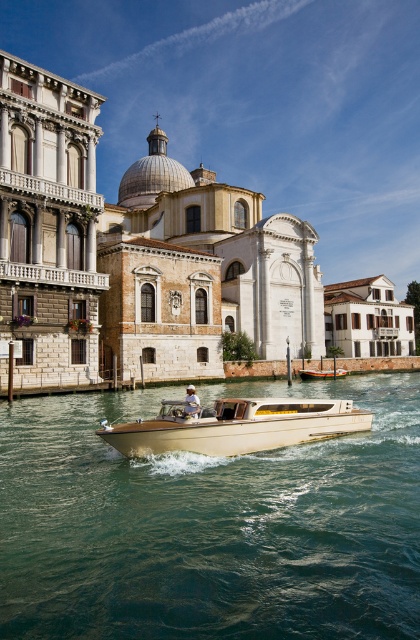
Question: Which point is farther to the camera?

Choices:
 (A) (247, 480)
 (B) (173, 428)
 (C) (309, 371)

Answer: (C)

Question: Does clear blue water at center have a lesser width compared to beige polished wood boat at center?

Choices:
 (A) yes
 (B) no

Answer: (B)

Question: Which point is closer to the camera taking this photo?

Choices:
 (A) (333, 372)
 (B) (289, 445)
 (C) (159, 445)

Answer: (C)

Question: Does beige polished wood boat at center appear on the right side of wooden polished boat at center?

Choices:
 (A) no
 (B) yes

Answer: (A)

Question: Which object appears closest to the camera in this image?

Choices:
 (A) wooden polished boat at center
 (B) beige polished wood boat at center

Answer: (B)

Question: Can you confirm if beige polished wood boat at center is thinner than wooden polished boat at center?

Choices:
 (A) yes
 (B) no

Answer: (B)